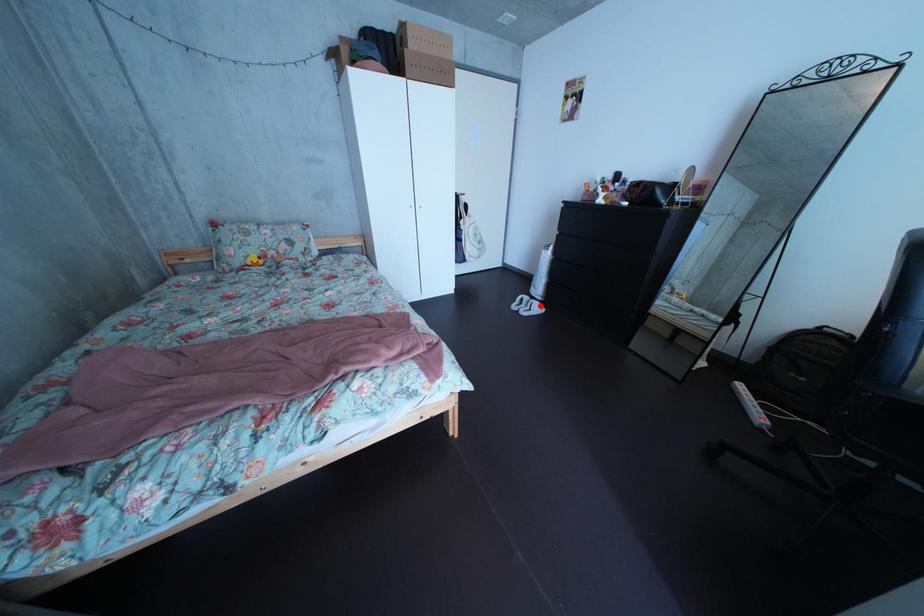
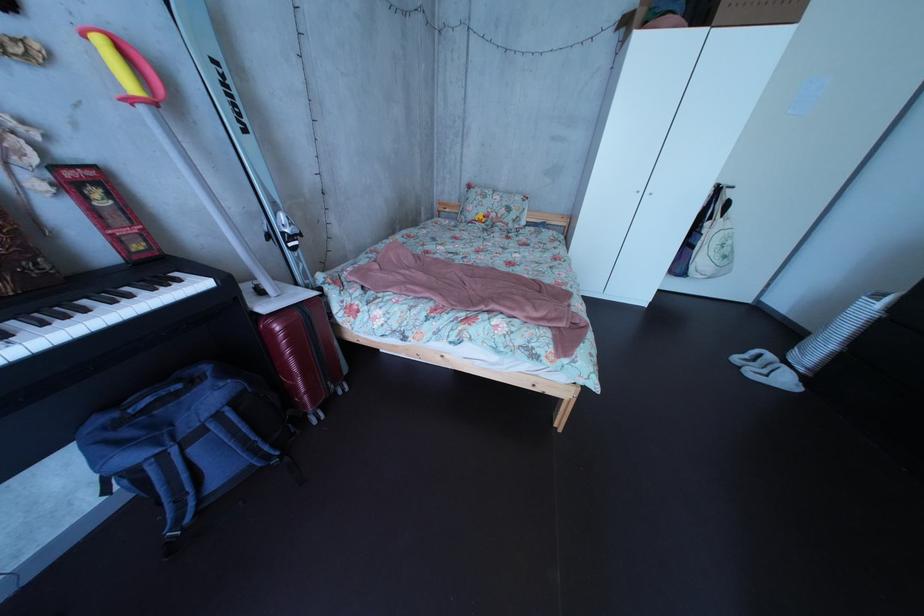
Where in the second image is the point corresponding to the highlighted location from the first image?

(784, 363)